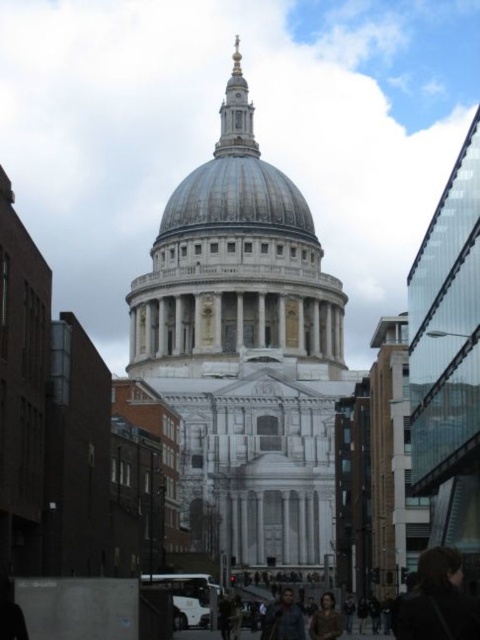
Which is below, dark brown hair at lower right or dark blue shirt at center?

Positioned lower is dark blue shirt at center.

Who is shorter, dark brown hair at lower right or dark blue shirt at center?

With less height is dark brown hair at lower right.

Who is more forward, [418,582] or [289,595]?

Point [418,582] is in front.

I want to click on dark brown hair at lower right, so click(x=437, y=600).

Describe the element at coordinates (245, 353) in the screenshot. Image resolution: width=480 pixels, height=640 pixels. I see `white marble cathedral at center` at that location.

You are a GUI agent. You are given a task and a screenshot of the screen. Output one action in this format:
    pyautogui.click(x=<x>, y=<y>)
    Task: Click on the white marble cathedral at center
    Image resolution: width=480 pixels, height=640 pixels.
    Given the screenshot: What is the action you would take?
    pyautogui.click(x=245, y=353)

Does point (336, 300) lie behind point (276, 618)?

Yes, it is behind point (276, 618).

Is white marble cathedral at center positioned behind dark blue shirt at center?

Yes, white marble cathedral at center is further from the viewer.

Between point (187, 186) and point (291, 618), which one is positioned behind?

The point (187, 186) is behind.

At what (x,y) coordinates should I click in order to perform the action: click on white marble cathedral at center. Please return your answer as a coordinate pair (x, y). The width and height of the screenshot is (480, 640). Looking at the image, I should click on (245, 353).